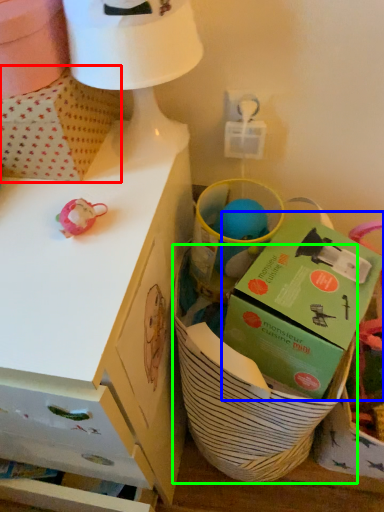
Question: Which is farther away from cardboard box (highlighted by a red box)? box (highlighted by a blue box) or basket (highlighted by a green box)?

Choices:
 (A) box
 (B) basket

Answer: (B)